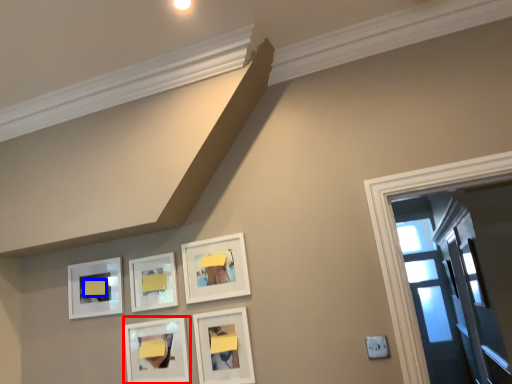
Question: Which point is closer to the camera, picture frame (highlighted by a red box) or furniture (highlighted by a blue box)?

Choices:
 (A) picture frame
 (B) furniture

Answer: (A)